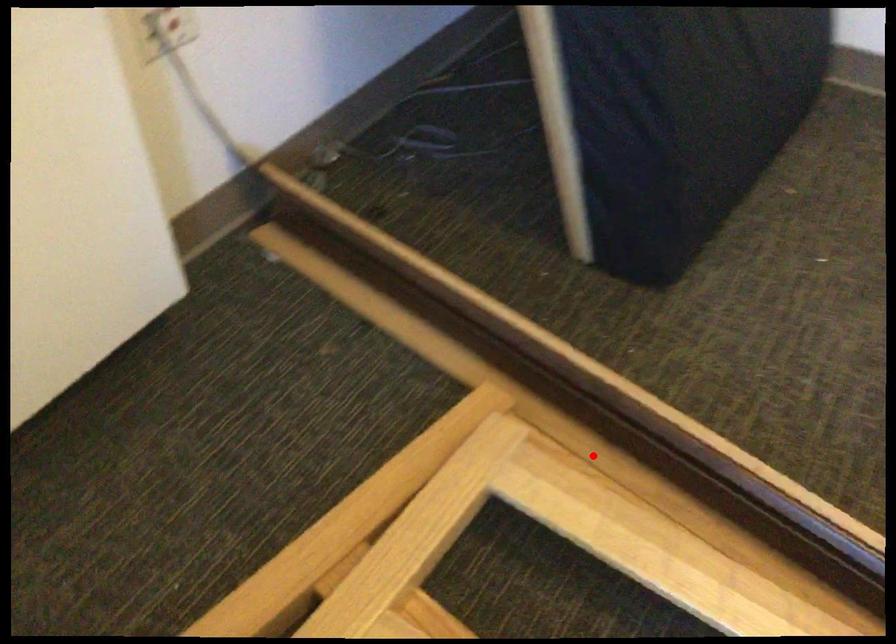
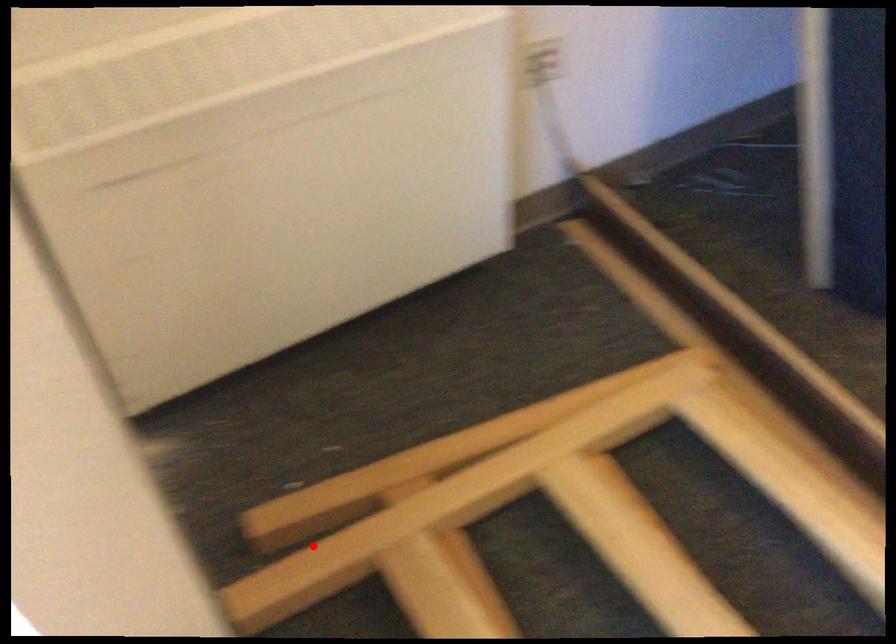
I am providing you with two images of the same scene from different viewpoints. A red point is marked on the first image and another point is marked on the second image. Is the marked point in image1 the same physical position as the marked point in image2?

No